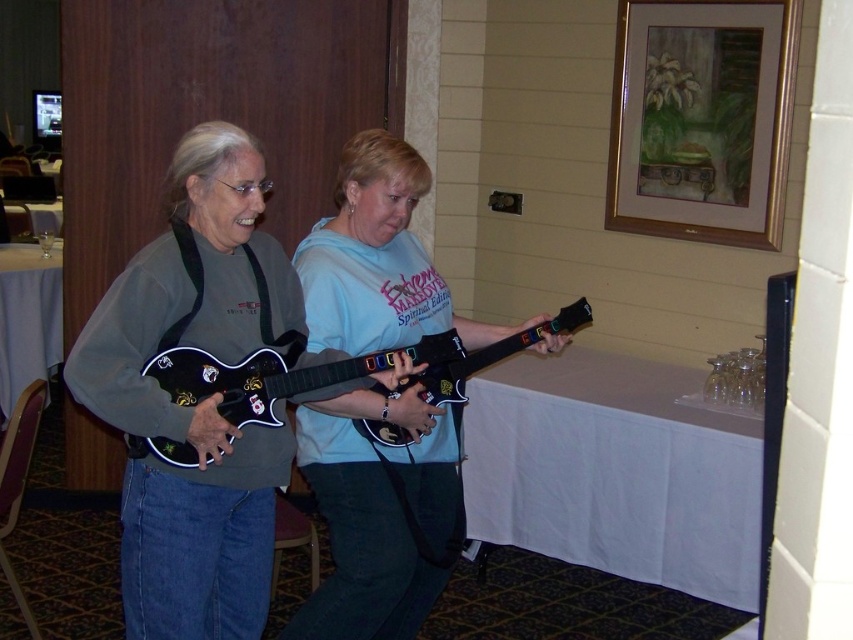
Question: Which object is the farthest from the black glossy electric guitar at center?

Choices:
 (A) matte black guitar at center
 (B) glossy plastic guitar at center
 (C) light blue fabric guitar at center

Answer: (C)

Question: Which point is farther to the camera?

Choices:
 (A) (15, 352)
 (B) (372, 579)
 (C) (541, 337)

Answer: (A)

Question: Can you confirm if white cloth at left is bigger than glossy plastic guitar at center?

Choices:
 (A) no
 (B) yes

Answer: (B)

Question: Is black glossy electric guitar at center in front of white cloth at left?

Choices:
 (A) no
 (B) yes

Answer: (B)

Question: Which point is closer to the camera?

Choices:
 (A) white cloth at lower right
 (B) light blue fabric guitar at center

Answer: (B)

Question: Can you confirm if light blue fabric guitar at center is positioned to the right of glossy plastic guitar at center?

Choices:
 (A) yes
 (B) no

Answer: (B)